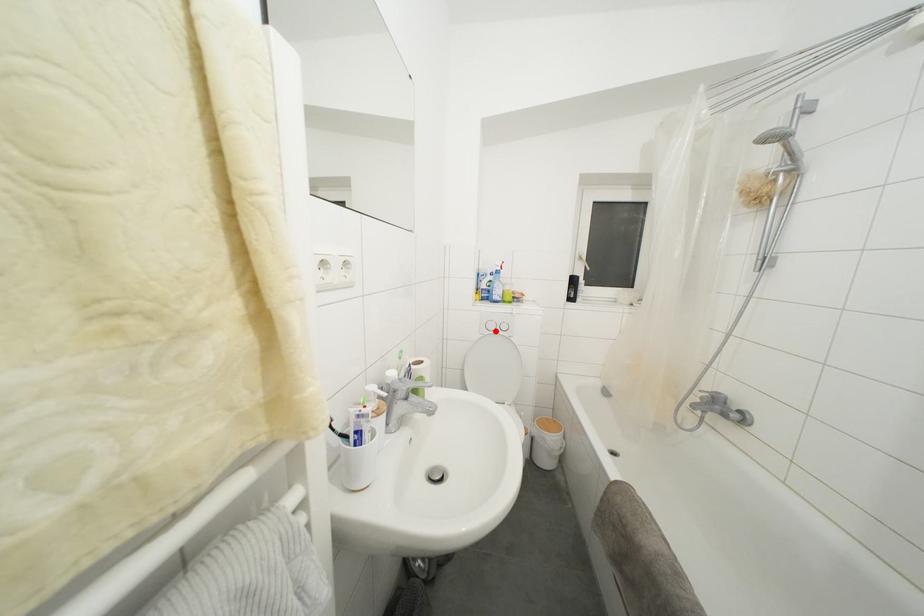
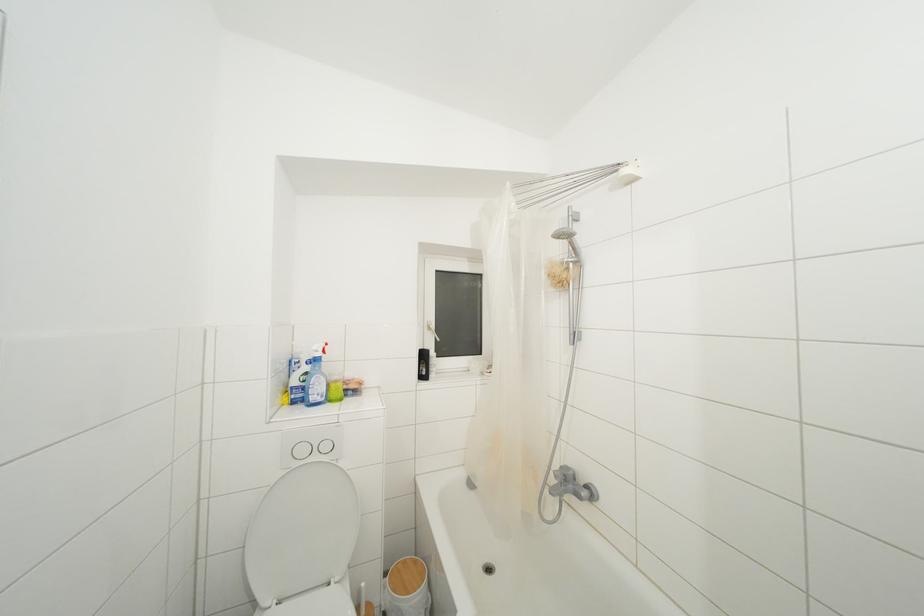
The point at the highlighted location is marked in the first image. Where is the corresponding point in the second image?

(307, 456)